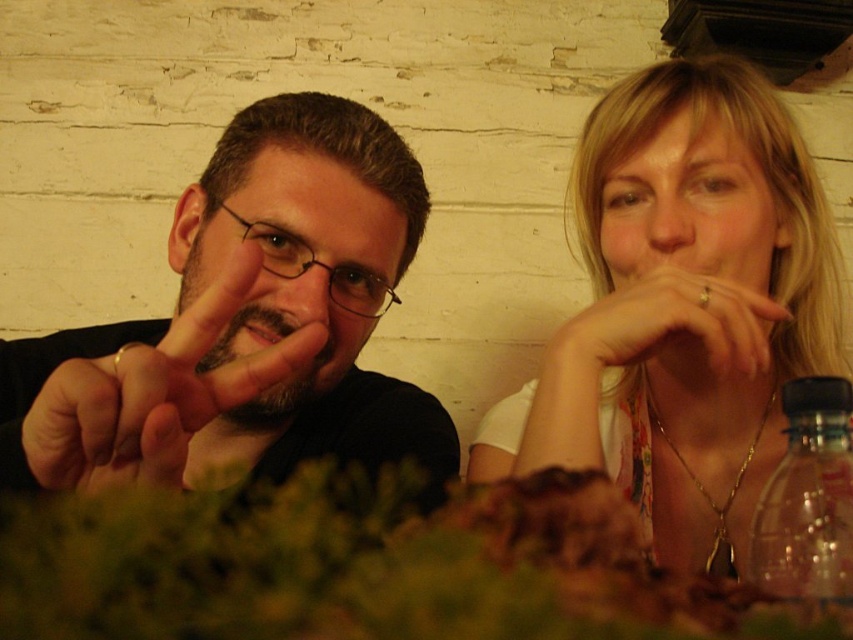
Who is more distant from viewer, [177,397] or [675,365]?

Point [675,365]

Does black matte hand at left have a lesser height compared to gold ring at upper right?

No, black matte hand at left is not shorter than gold ring at upper right.

Which is in front, point (109, 369) or point (757, 320)?

Point (109, 369) is more forward.

Identify the location of black matte hand at left. (154, 394).

Does gold ring at upper right have a larger size compared to clear plastic bottle at right?

Correct, gold ring at upper right is larger in size than clear plastic bottle at right.

Is the position of gold ring at upper right less distant than that of clear plastic bottle at right?

That is False.

Identify the location of gold ring at upper right. The width and height of the screenshot is (853, 640). (666, 332).

Is matte black shirt at left positioned behind black matte hand at left?

No, matte black shirt at left is closer to the viewer.

Does point (256, 428) come closer to viewer compared to point (160, 420)?

No.

Describe the element at coordinates (247, 324) in the screenshot. The width and height of the screenshot is (853, 640). I see `matte black shirt at left` at that location.

Locate an element on the screen. matte black shirt at left is located at coordinates (247, 324).